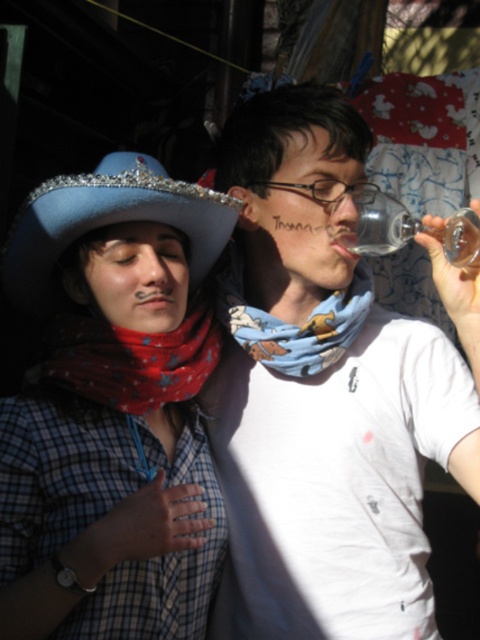
Question: Is blue felt hat at upper left below blue bandana at center?

Choices:
 (A) yes
 (B) no

Answer: (A)

Question: Is blue felt hat at upper left bigger than blue bandana at center?

Choices:
 (A) no
 (B) yes

Answer: (B)

Question: Based on their relative distances, which object is nearer to the blue rhinestone cowboy hat at upper left?

Choices:
 (A) printed cotton scarf at center
 (B) blue felt hat at upper left
 (C) transparent glass at upper right

Answer: (B)

Question: Which object is the closest to the blue felt hat at upper left?

Choices:
 (A) blue rhinestone cowboy hat at upper left
 (B) printed cotton scarf at center

Answer: (A)

Question: Which point is farther from the camera taking this photo?

Choices:
 (A) (118, 404)
 (B) (243, 294)
 (C) (332, 337)

Answer: (B)

Question: Is blue felt hat at upper left smaller than transparent glass at upper right?

Choices:
 (A) yes
 (B) no

Answer: (B)